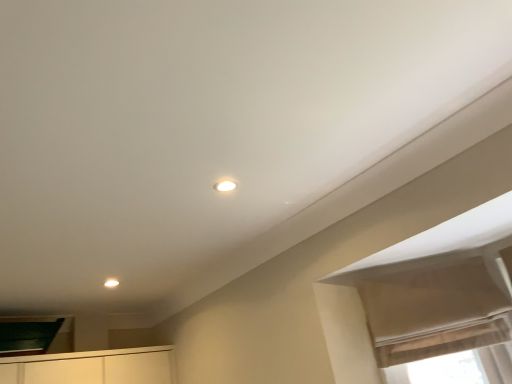
The image size is (512, 384). I want to click on dark green fabric at lower left, so click(27, 337).

The width and height of the screenshot is (512, 384). What do you see at coordinates (27, 337) in the screenshot? I see `dark green fabric at lower left` at bounding box center [27, 337].

This screenshot has width=512, height=384. In order to click on dark green fabric at lower left in this screenshot , I will do `click(27, 337)`.